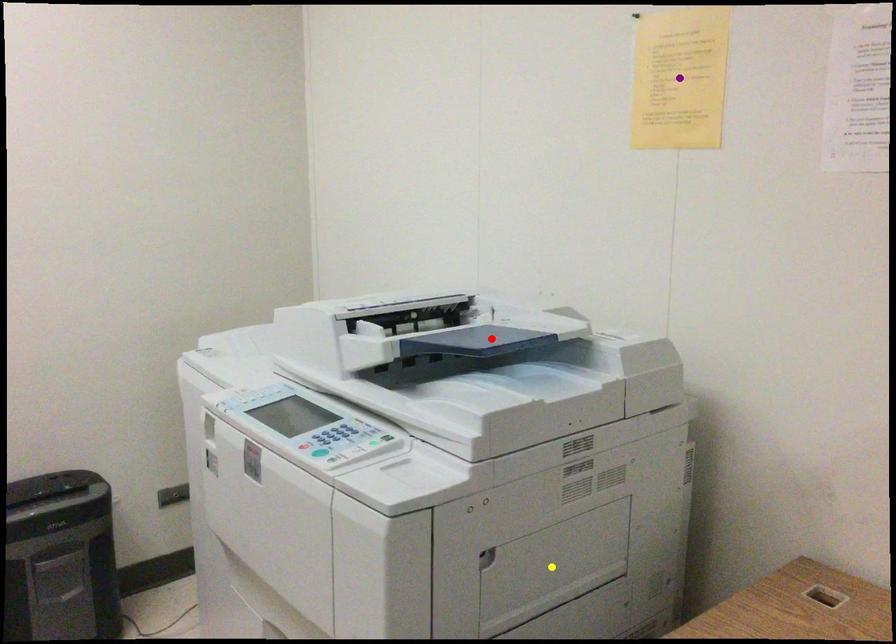
Order these from nearest to farthest:
1. red point
2. yellow point
3. purple point

yellow point, red point, purple point